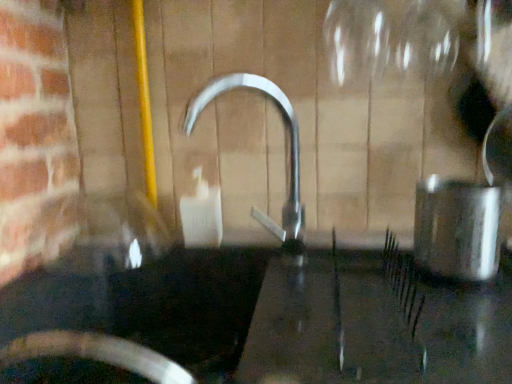
Measure the distance between point [232,86] and camera.

Point [232,86] and camera are 32.60 inches apart.

Describe the element at coordinates (290, 149) in the screenshot. This screenshot has height=384, width=512. I see `polished metal tap at center` at that location.

Identify the location of polished metal tap at center. The height and width of the screenshot is (384, 512). (290, 149).

Image resolution: width=512 pixels, height=384 pixels. Find the location of `polished metal tap at center`. polished metal tap at center is located at coordinates [290, 149].